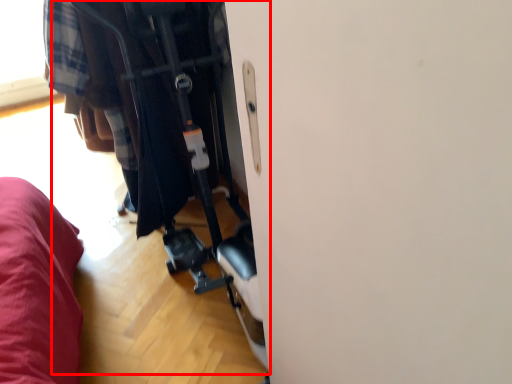
Question: From the image's perspective, what is the correct spatial relationship of baby carriage (annotated by the red box) in relation to clothing?

Choices:
 (A) above
 (B) below

Answer: (B)